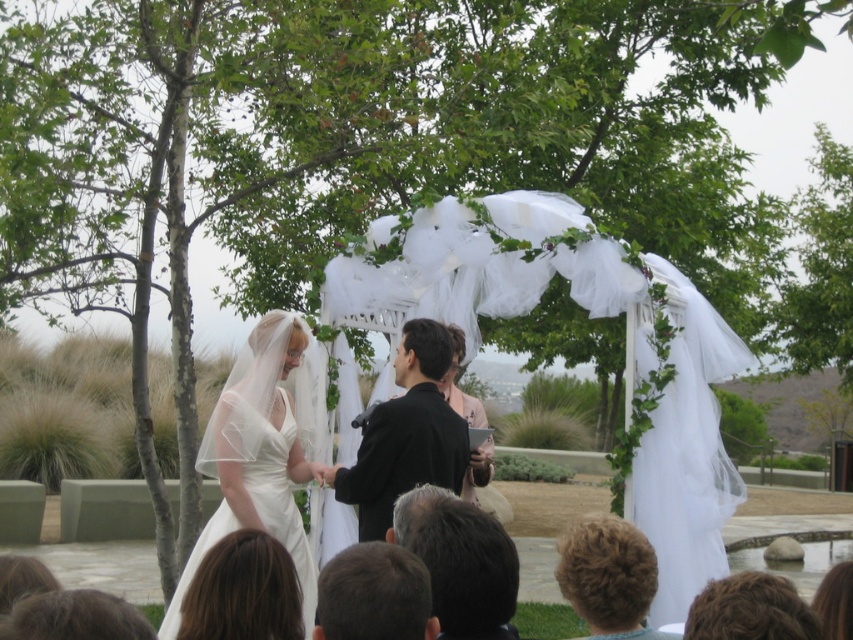
Question: Can you confirm if white satin dress at left is positioned below gray hair at center?

Choices:
 (A) no
 (B) yes

Answer: (A)

Question: Is black smooth suit at center wider than dark brown hair at center?

Choices:
 (A) yes
 (B) no

Answer: (A)

Question: Which point is farther from the camera taking this photo?

Choices:
 (A) (422, 612)
 (B) (306, 340)
 (C) (691, 483)

Answer: (B)

Question: Which of the following is the farthest from the observer?

Choices:
 (A) white satin dress at left
 (B) gray hair at center

Answer: (A)

Question: Which object is the farthest from the black smooth suit at center?

Choices:
 (A) dark brown hair at center
 (B) white tulle canopy at center
 (C) white satin dress at left

Answer: (A)

Question: Is the position of white satin dress at left more distant than that of black smooth suit at center?

Choices:
 (A) yes
 (B) no

Answer: (B)